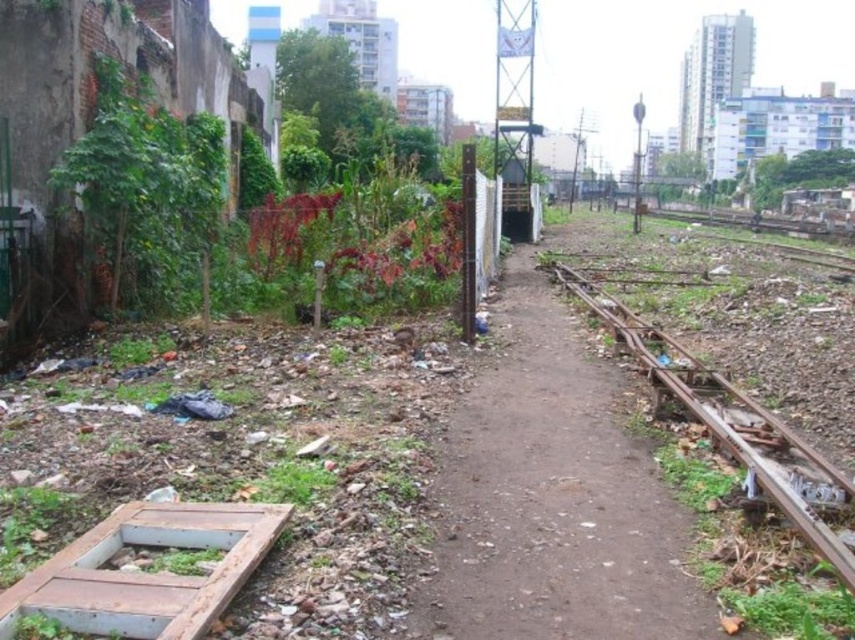
Question: Does dirt path at center have a larger size compared to rusty metal train track at right?

Choices:
 (A) yes
 (B) no

Answer: (A)

Question: Among these points, which one is nearest to the camera?

Choices:
 (A) [616, 376]
 (B) [823, 460]

Answer: (B)

Question: Is dirt path at center bigger than rusty metal train track at right?

Choices:
 (A) no
 (B) yes

Answer: (B)

Question: Does dirt path at center have a larger size compared to rusty metal train track at right?

Choices:
 (A) no
 (B) yes

Answer: (B)

Question: Which of the following is the farthest from the observer?

Choices:
 (A) rusty metal train track at right
 (B) dirt path at center

Answer: (B)